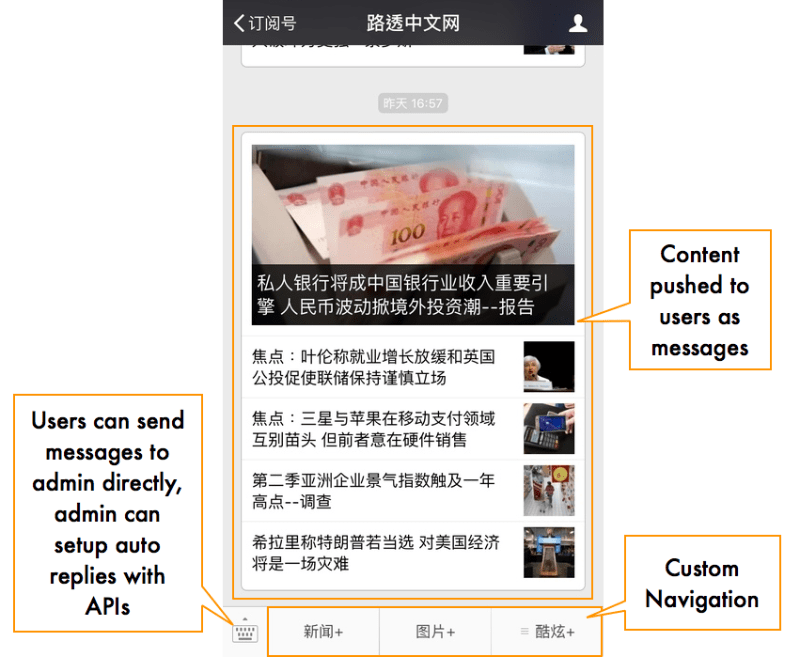
Locate an element on the screen. This screenshot has width=800, height=657. keyboard button is located at coordinates (244, 633).